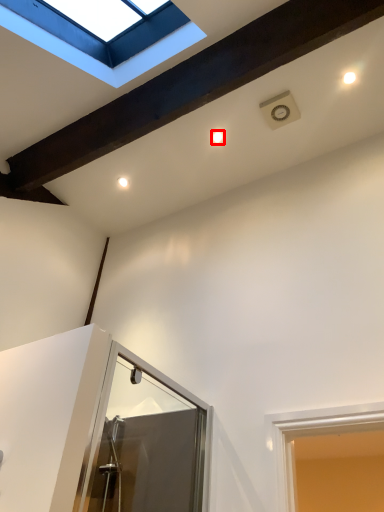
Question: From the image's perspective, considering the relative positions of droplight (annotated by the red box) and window in the image provided, where is droplight (annotated by the red box) located with respect to the staircase?

Choices:
 (A) below
 (B) above

Answer: (A)